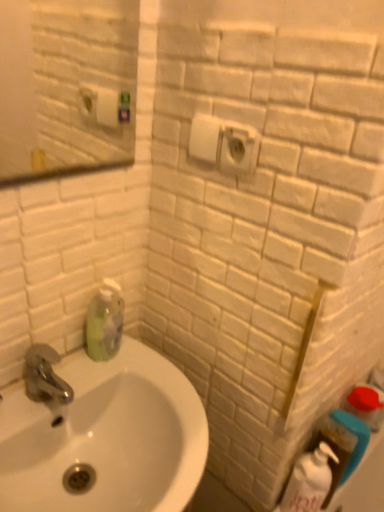
Question: From a real-world perspective, is white glossy bottle at lower right, the 2th cleaning product in the top-to-bottom sequence, over white glossy sink at lower left?

Choices:
 (A) no
 (B) yes

Answer: (A)

Question: From a real-world perspective, is white glossy bottle at lower right, the 2th cleaning product positioned from the left, located beneath white glossy sink at lower left?

Choices:
 (A) no
 (B) yes

Answer: (B)

Question: Is white glossy bottle at lower right, positioned as the 1th cleaning product in bottom-to-top order, touching white glossy sink at lower left?

Choices:
 (A) no
 (B) yes

Answer: (A)

Question: Does white glossy bottle at lower right, the 2th cleaning product in the top-to-bottom sequence, have a smaller size compared to white glossy sink at lower left?

Choices:
 (A) yes
 (B) no

Answer: (A)

Question: Is white glossy bottle at lower right, positioned as the 1th cleaning product in bottom-to-top order, oriented towards white glossy sink at lower left?

Choices:
 (A) yes
 (B) no

Answer: (B)

Question: Is white glossy bottle at lower right, the 2th cleaning product positioned from the left, wider than white glossy sink at lower left?

Choices:
 (A) no
 (B) yes

Answer: (A)

Question: Considering the relative sizes of white glossy sink at lower left and white plastic electric outlet at upper center in the image provided, is white glossy sink at lower left bigger than white plastic electric outlet at upper center?

Choices:
 (A) yes
 (B) no

Answer: (A)

Question: Considering the relative sizes of white glossy sink at lower left and white plastic electric outlet at upper center in the image provided, is white glossy sink at lower left smaller than white plastic electric outlet at upper center?

Choices:
 (A) yes
 (B) no

Answer: (B)

Question: Can you confirm if white glossy sink at lower left is shorter than white plastic electric outlet at upper center?

Choices:
 (A) yes
 (B) no

Answer: (B)

Question: Is white glossy sink at lower left behind white plastic electric outlet at upper center?

Choices:
 (A) yes
 (B) no

Answer: (B)

Question: Is white glossy sink at lower left looking in the opposite direction of white plastic electric outlet at upper center?

Choices:
 (A) no
 (B) yes

Answer: (A)

Question: From a real-world perspective, is white glossy sink at lower left physically below white plastic electric outlet at upper center?

Choices:
 (A) yes
 (B) no

Answer: (A)

Question: Is white glossy bottle at lower right, positioned as the 1th cleaning product in bottom-to-top order, located within white plastic electric outlet at upper center?

Choices:
 (A) no
 (B) yes

Answer: (A)